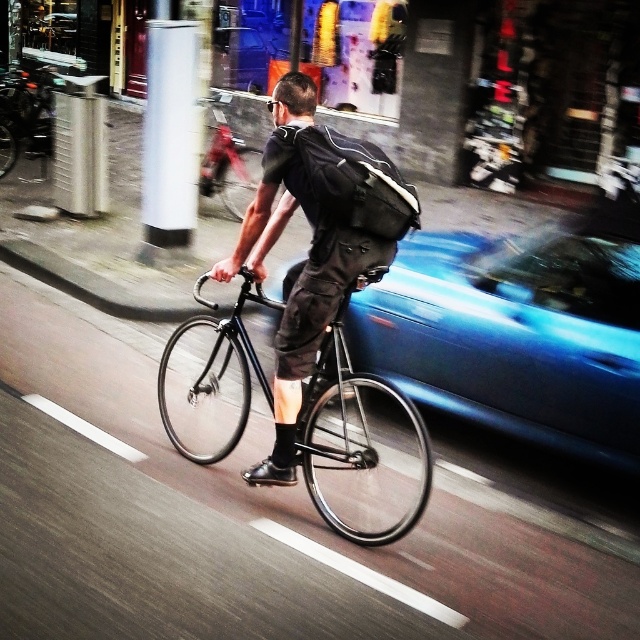
Can you confirm if shiny black bicycle at center is positioned to the right of white glossy pillar at upper left?

Yes, shiny black bicycle at center is to the right of white glossy pillar at upper left.

Does point (163, 380) come behind point (188, 131)?

No.

In order to click on shiny black bicycle at center in this screenshot , I will do `click(356, 444)`.

What do you see at coordinates (513, 333) in the screenshot? The height and width of the screenshot is (640, 640). I see `blue metallic car at center` at bounding box center [513, 333].

Who is shorter, blue metallic car at center or black matte bicycle at center?

blue metallic car at center is shorter.

What do you see at coordinates (513, 333) in the screenshot?
I see `blue metallic car at center` at bounding box center [513, 333].

Where is `blue metallic car at center`? blue metallic car at center is located at coordinates (513, 333).

Which is in front, point (632, 282) or point (160, 122)?

Positioned in front is point (632, 282).

Between blue metallic car at center and white glossy pillar at upper left, which one appears on the left side from the viewer's perspective?

white glossy pillar at upper left

The height and width of the screenshot is (640, 640). Describe the element at coordinates (513, 333) in the screenshot. I see `blue metallic car at center` at that location.

Where is `blue metallic car at center`? blue metallic car at center is located at coordinates (513, 333).